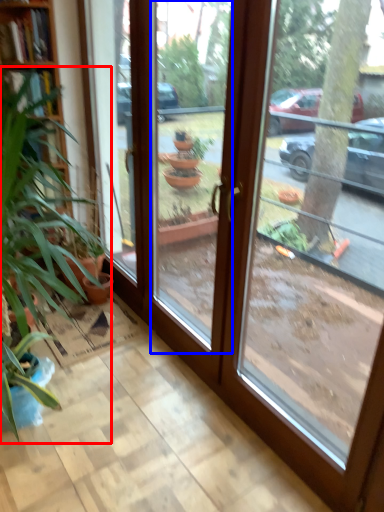
Question: Which object appears closest to the camera in this image, houseplant (highlighted by a red box) or window (highlighted by a blue box)?

Choices:
 (A) houseplant
 (B) window

Answer: (B)